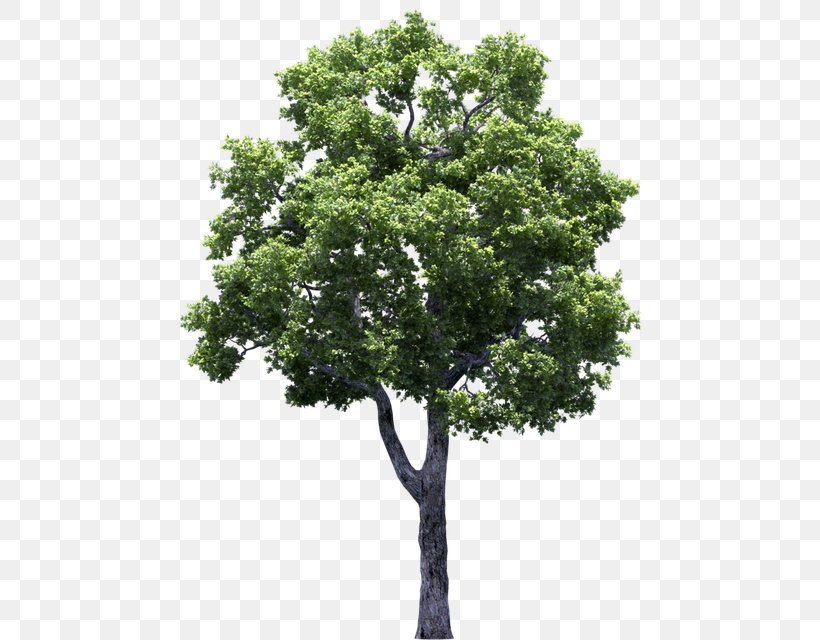
The height and width of the screenshot is (640, 820). I want to click on checkerboard pattern, so click(196, 506).